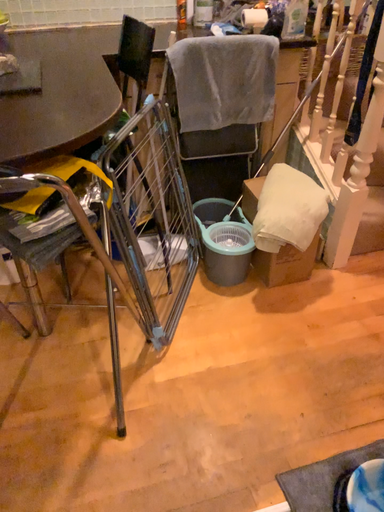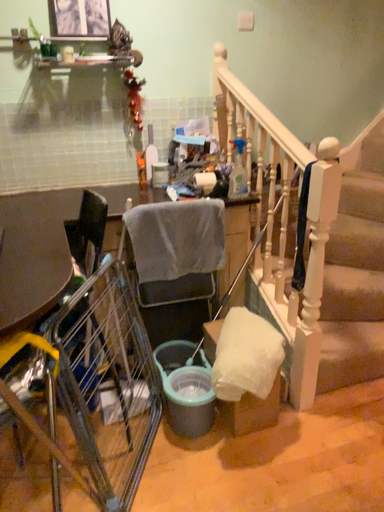
Question: Which way did the camera rotate in the video?

Choices:
 (A) rotated upward
 (B) rotated downward

Answer: (A)